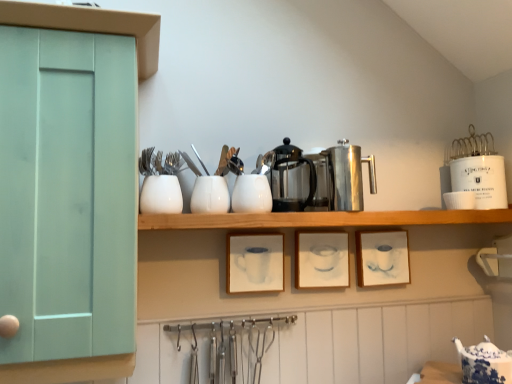
Question: Based on their positions, is white glossy fork at upper center, which is the sixth tableware in right-to-left order, located to the left or right of white glossy vase at upper center, which is counted as the 1th tableware, starting from the left?

Choices:
 (A) left
 (B) right

Answer: (B)

Question: Is white glossy fork at upper center, the second tableware positioned from the top, inside or outside of white glossy vase at upper center, the fourth tableware ordered from the bottom?

Choices:
 (A) inside
 (B) outside

Answer: (B)

Question: Based on their relative distances, which object is farther from the polished stainless steel coffee press at center, the second appliance positioned from the right?

Choices:
 (A) white matte picture frame at center, marked as the 1th picture frame in a left-to-right arrangement
 (B) satin silver spoon at upper center, positioned as the 7th tableware in bottom-to-top order
 (C) matte white picture frame at center, the 1th picture frame positioned from the right
 (D) satin silver carafe at center, acting as the third appliance starting from the right
 (E) white glossy vase at center, the fifth tableware viewed from the top

Answer: (B)

Question: Considering the real-world distances, which object is closest to the matte white picture frame at center, which ranks as the 2th picture frame in left-to-right order?

Choices:
 (A) mint green wood cabinet at left
 (B) wooden shelf at center
 (C) matte white picture frame at center, the 1th picture frame positioned from the right
 (D) satin silver carafe at center, placed as the second appliance when sorted from left to right
 (E) white glossy cup at upper right, placed as the sixth tableware when sorted from left to right

Answer: (C)